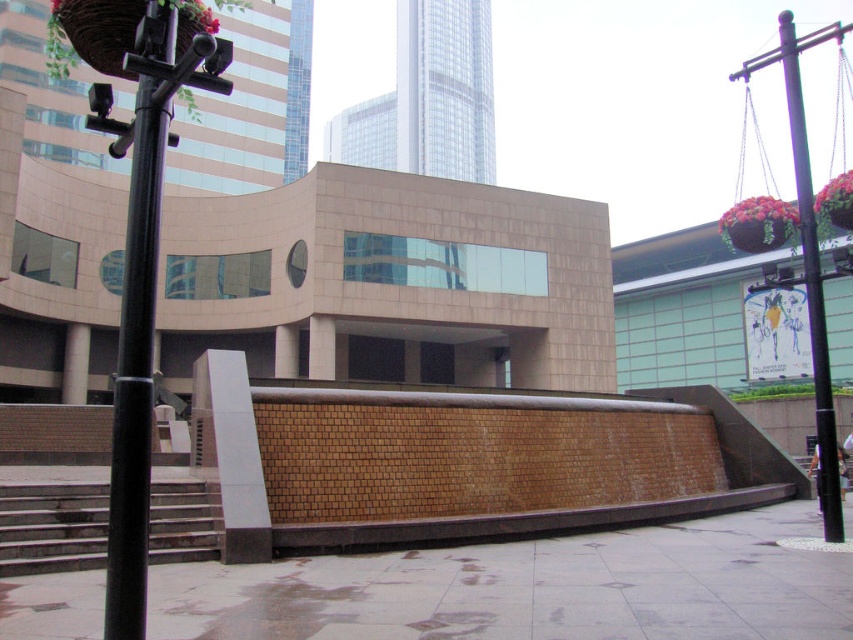
Is brown concrete pavement at center below black metal pole at right?

Indeed, brown concrete pavement at center is positioned under black metal pole at right.

Can you confirm if brown concrete pavement at center is smaller than black metal pole at right?

Indeed, brown concrete pavement at center has a smaller size compared to black metal pole at right.

Does point (212, 605) lie in front of point (791, 100)?

Yes, point (212, 605) is in front of point (791, 100).

Image resolution: width=853 pixels, height=640 pixels. In order to click on brown concrete pavement at center in this screenshot , I will do `click(531, 588)`.

Can you confirm if black metal pole at left is positioned above black metal pole at right?

Incorrect, black metal pole at left is not positioned above black metal pole at right.

Measure the distance between point (132, 561) and camera.

The distance of point (132, 561) from camera is 12.14 feet.

You are a GUI agent. You are given a task and a screenshot of the screen. Output one action in this format:
    pyautogui.click(x=<x>, y=<y>)
    Task: Click on the black metal pole at left
    The image size is (853, 640).
    Given the screenshot: What is the action you would take?
    pyautogui.click(x=138, y=323)

Does brown concrete pavement at center have a lesser height compared to concrete stairs at lower left?

In fact, brown concrete pavement at center may be taller than concrete stairs at lower left.

Measure the distance between brown concrete pavement at center and concrete stairs at lower left.

The distance of brown concrete pavement at center from concrete stairs at lower left is 12.84 feet.

Is point (675, 618) in front of point (94, 474)?

Yes, it is.

Locate an element on the screen. The width and height of the screenshot is (853, 640). brown concrete pavement at center is located at coordinates (531, 588).